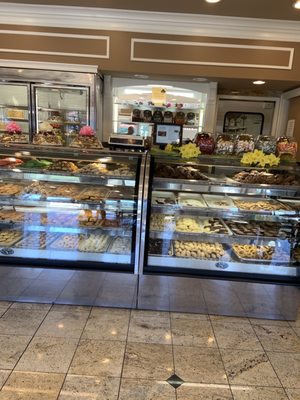
You are a GUI agent. You are given a task and a screenshot of the screen. Output one action in this format:
    pyautogui.click(x=<x>, y=<y>)
    Task: Click on the screen
    
    Given the screenshot: What is the action you would take?
    pyautogui.click(x=167, y=135)